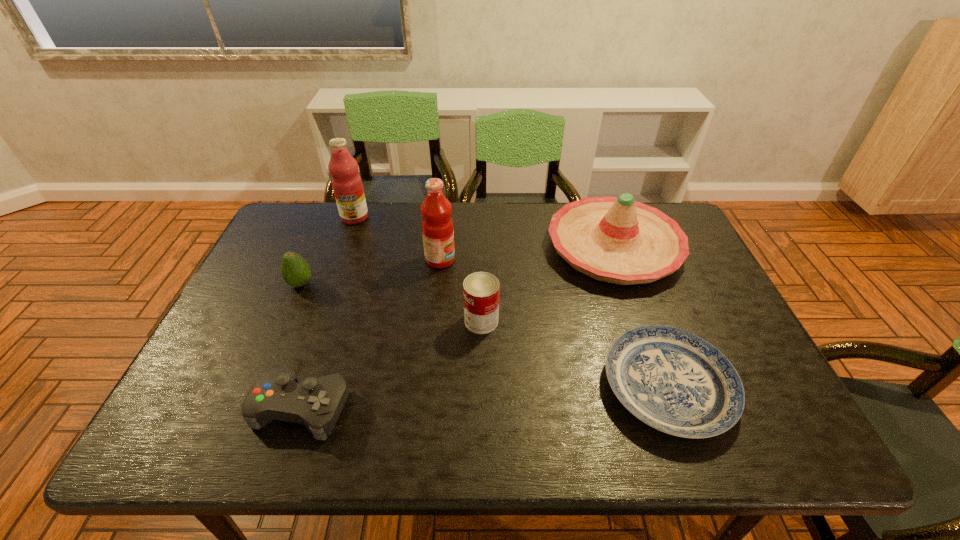
Where is `the farther fruit juice`? This screenshot has height=540, width=960. the farther fruit juice is located at coordinates (347, 185).

Where is `the right fruit juice`? the right fruit juice is located at coordinates (437, 225).

Locate an element on the screen. The image size is (960, 540). the fourth object from right to left is located at coordinates (437, 225).

Where is `sombrero`? sombrero is located at coordinates (619, 240).

Find the location of a particular element. can is located at coordinates (481, 290).

Identify the location of the fifth farthest object. This screenshot has height=540, width=960. pos(481,290).

The height and width of the screenshot is (540, 960). In order to click on avocado in this screenshot , I will do `click(295, 270)`.

Image resolution: width=960 pixels, height=540 pixels. Find the location of `control`. control is located at coordinates (316, 403).

At what (x,y) coordinates should I click in order to perform the action: click on the shortest object. Please return your answer as a coordinate pair (x, y). Looking at the image, I should click on (674, 381).

The height and width of the screenshot is (540, 960). Find the location of `free space located on the label of the left fruit juice`. free space located on the label of the left fruit juice is located at coordinates (348, 237).